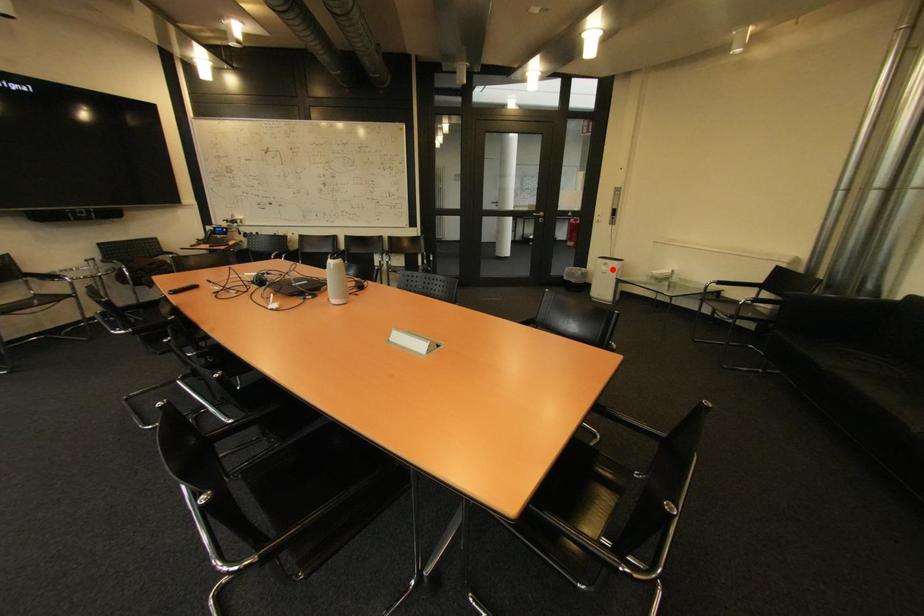
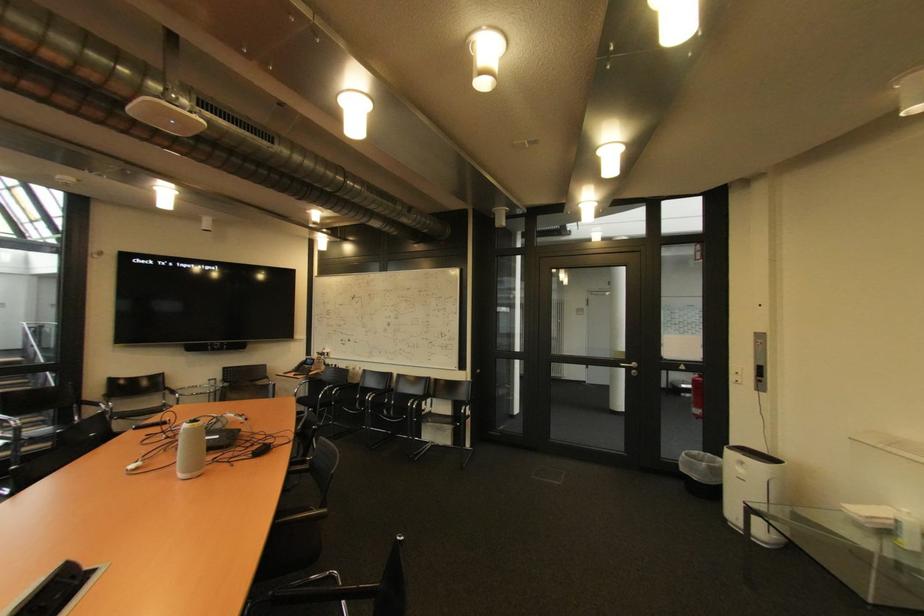
Question: A red point is marked in image1. In image2, is the corresponding 3D point closer to the camera or farther? Reply with the corresponding letter.

Choices:
 (A) The corresponding 3D point is closer.
 (B) The corresponding 3D point is farther.

Answer: (B)